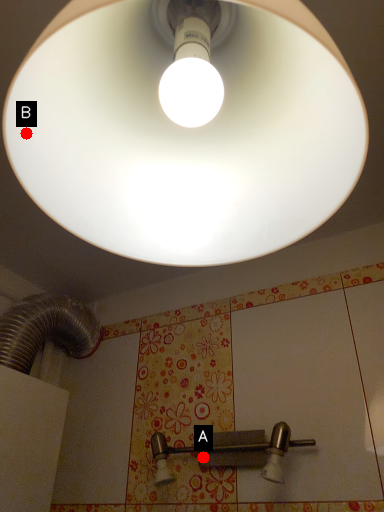
Question: Two points are circled on the image, labeled by A and B beside each circle. Which point is closer to the camera taking this photo?

Choices:
 (A) A is closer
 (B) B is closer

Answer: (B)